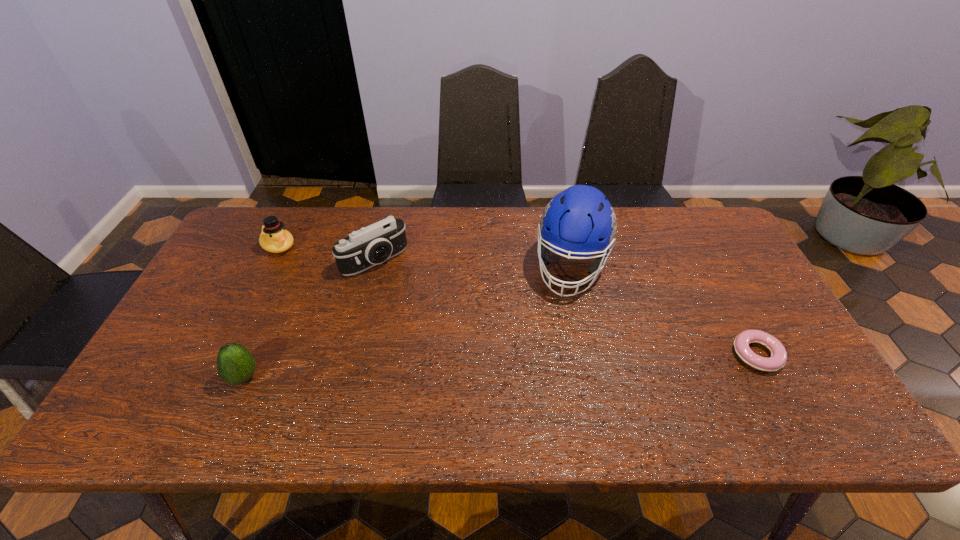
Where is `free spot on the desktop that is between the avocado and the rightmost object and is positioned on the front lens of the third object from right to left`? The image size is (960, 540). free spot on the desktop that is between the avocado and the rightmost object and is positioned on the front lens of the third object from right to left is located at coordinates (472, 367).

Find the location of `vacant spot on the desktop that is between the avocado and the shortest object and is positioned on the face guard of the fourth object from left to right`. vacant spot on the desktop that is between the avocado and the shortest object and is positioned on the face guard of the fourth object from left to right is located at coordinates (545, 364).

Locate an element on the screen. The width and height of the screenshot is (960, 540). free space on the desktop that is between the avocado and the rightmost object and is positioned on the front-facing side of the duck is located at coordinates (429, 369).